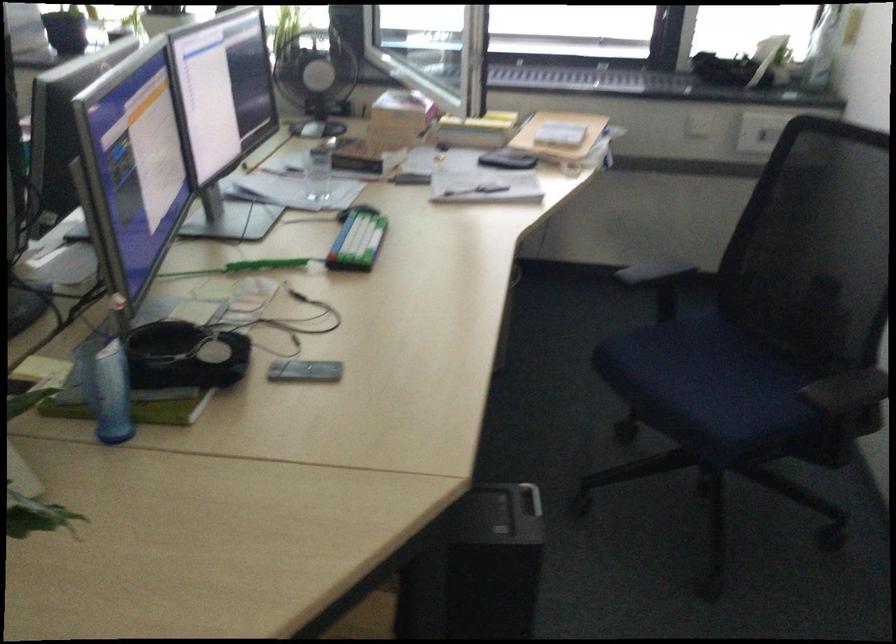
Where would you pull the computer case handle? Please return your answer as a coordinate pair (x, y).

(531, 498)